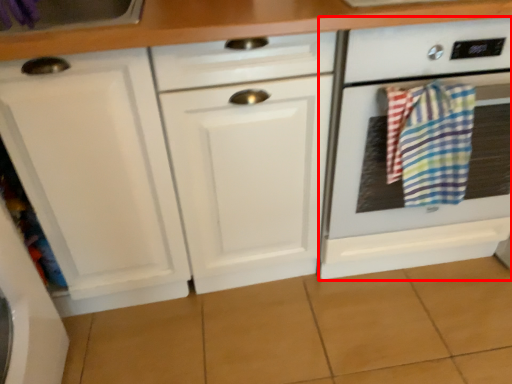
Question: Where is home appliance (annotated by the red box) located in relation to beach towel in the image?

Choices:
 (A) right
 (B) left

Answer: (A)